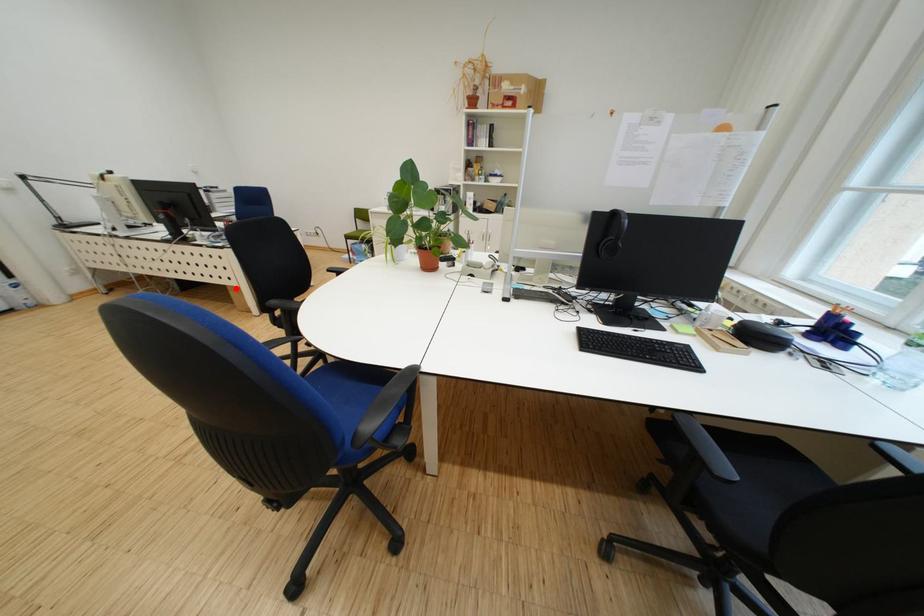
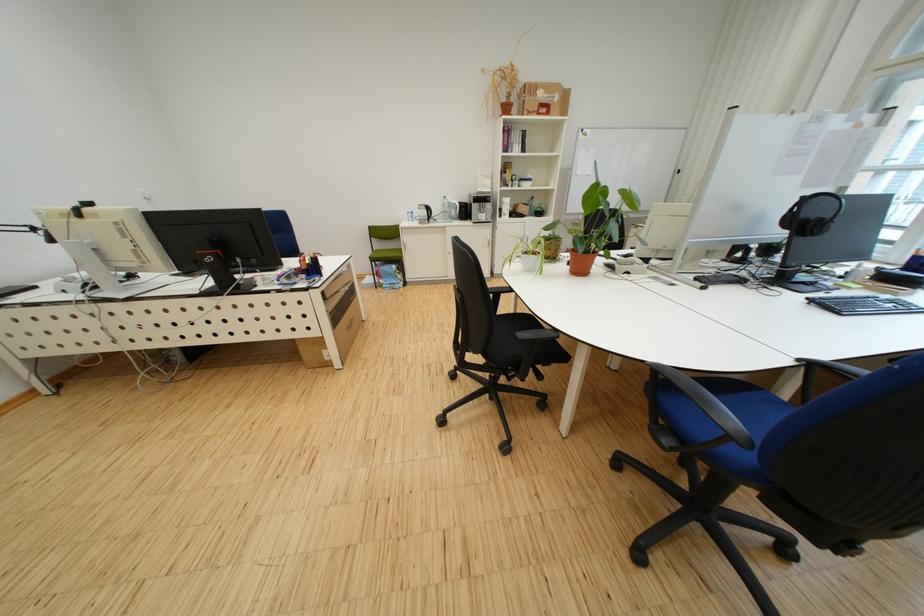
Question: A red point is marked in image1. In image2, is the corresponding 3D point closer to the camera or farther? Reply with the corresponding letter.

Choices:
 (A) The corresponding 3D point is closer.
 (B) The corresponding 3D point is farther.

Answer: (A)